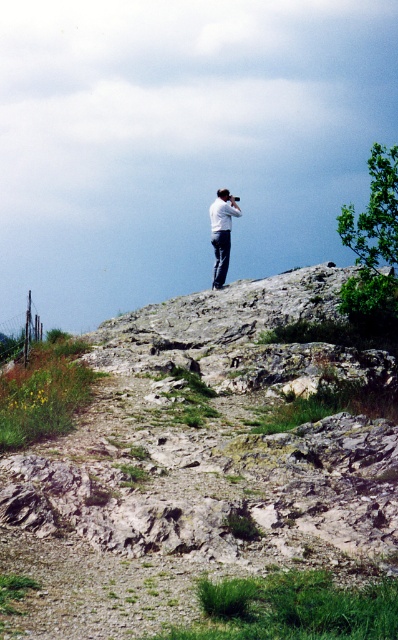
Is gray rocky hillside at upper center wider than white fabric camera at upper center?

Indeed, gray rocky hillside at upper center has a greater width compared to white fabric camera at upper center.

Which is in front, point (103, 384) or point (222, 228)?

Point (103, 384) is more forward.

The height and width of the screenshot is (640, 398). What are the coordinates of `gray rocky hillside at upper center` in the screenshot? It's located at (199, 464).